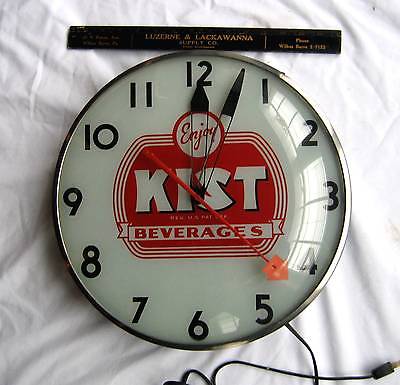
I want to click on plug, so click(x=390, y=366).